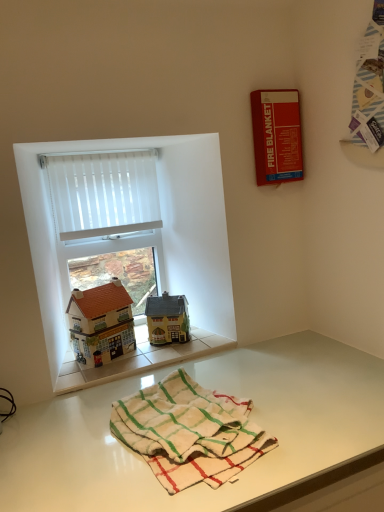
Question: Considering the relative sizes of white vertical blinds at upper left and white sheer curtain at upper left in the image provided, is white vertical blinds at upper left thinner than white sheer curtain at upper left?

Choices:
 (A) yes
 (B) no

Answer: (B)

Question: Is white vertical blinds at upper left closer to camera compared to white sheer curtain at upper left?

Choices:
 (A) no
 (B) yes

Answer: (A)

Question: Considering the relative positions of white vertical blinds at upper left and white sheer curtain at upper left in the image provided, is white vertical blinds at upper left to the right of white sheer curtain at upper left from the viewer's perspective?

Choices:
 (A) no
 (B) yes

Answer: (A)

Question: Can we say white vertical blinds at upper left lies outside white sheer curtain at upper left?

Choices:
 (A) no
 (B) yes

Answer: (B)

Question: Is white vertical blinds at upper left next to white sheer curtain at upper left?

Choices:
 (A) yes
 (B) no

Answer: (A)

Question: Is white vertical blinds at upper left aimed at white sheer curtain at upper left?

Choices:
 (A) no
 (B) yes

Answer: (B)

Question: Does matte brown house at left, the 1th toy from the left, lie in front of red matte fire blanket at upper right?

Choices:
 (A) yes
 (B) no

Answer: (A)

Question: Is matte brown house at left, the second toy viewed from the right, completely or partially outside of red matte fire blanket at upper right?

Choices:
 (A) yes
 (B) no

Answer: (A)

Question: Is matte brown house at left, the 1th toy from the left, far from red matte fire blanket at upper right?

Choices:
 (A) no
 (B) yes

Answer: (A)

Question: Can you confirm if matte brown house at left, the 1th toy from the left, is positioned to the right of red matte fire blanket at upper right?

Choices:
 (A) yes
 (B) no

Answer: (B)

Question: Does matte brown house at left, the second toy viewed from the right, have a smaller size compared to red matte fire blanket at upper right?

Choices:
 (A) no
 (B) yes

Answer: (A)

Question: Does matte brown house at left, the 1th toy from the left, appear on the left side of red matte fire blanket at upper right?

Choices:
 (A) yes
 (B) no

Answer: (A)

Question: Is white sheer curtain at upper left not within white vertical blinds at upper left?

Choices:
 (A) yes
 (B) no

Answer: (A)